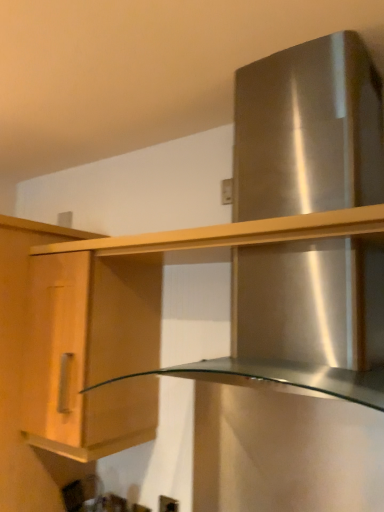
I want to click on light wood cabinet at left, so click(x=79, y=340).

Image resolution: width=384 pixels, height=512 pixels. Describe the element at coordinates (79, 340) in the screenshot. I see `light wood cabinet at left` at that location.

At what (x,y) coordinates should I click in order to perform the action: click on light wood cabinet at left. Please return your answer as a coordinate pair (x, y). The image size is (384, 512). Looking at the image, I should click on (79, 340).